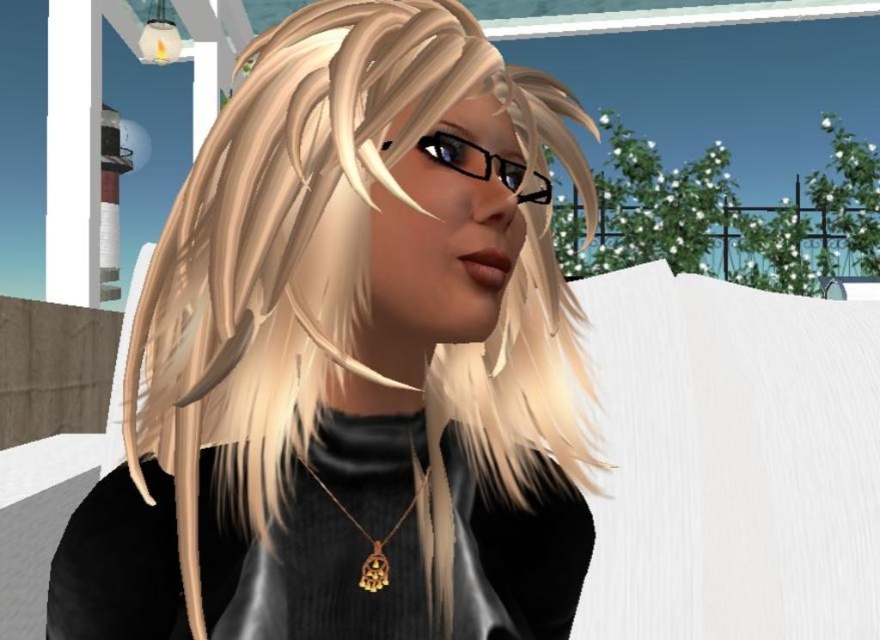
You are an artist trying to sketch this character. You need to decide which object to draw first based on their size. Which one should you start with, the blonde silky hair at center or the gold metallic pendant at center?

The blonde silky hair at center is wider than the gold metallic pendant at center, so you should start with the larger one, the blonde silky hair at center.